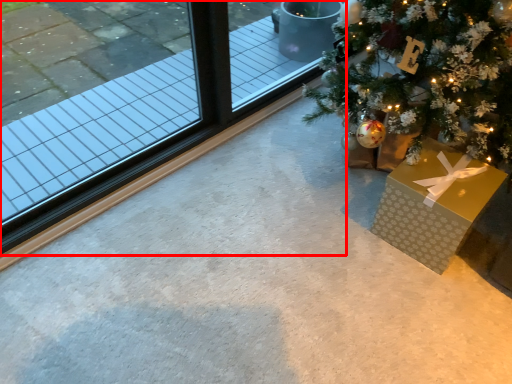
Question: Observing the image, what is the correct spatial positioning of window (annotated by the red box) in reference to gift box?

Choices:
 (A) left
 (B) right

Answer: (A)